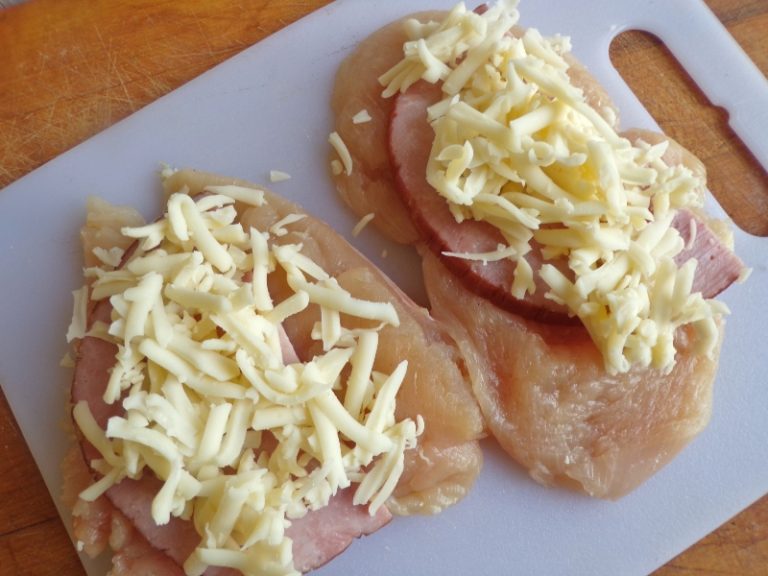
Identify the location of cutting board. (37, 257).